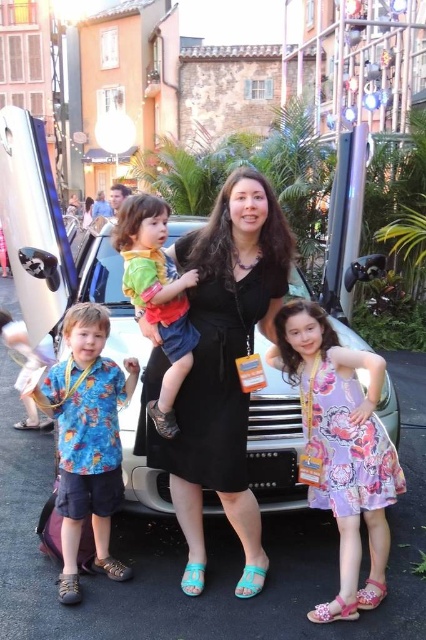
Question: Which of these objects is positioned farthest from the matte green shirt at center?

Choices:
 (A) matte black baby at upper left
 (B) floral dress at center
 (C) black matte dress at center
 (D) blue printed shirt at center

Answer: (A)

Question: Does floral dress at center come behind matte green shirt at center?

Choices:
 (A) no
 (B) yes

Answer: (A)

Question: Among these points, which one is nearest to the camera?

Choices:
 (A) (43, 403)
 (B) (310, 620)
 (C) (114, 205)

Answer: (B)

Question: Is black matte dress at center above floral dress at center?

Choices:
 (A) yes
 (B) no

Answer: (A)

Question: Among these points, which one is nearest to the camera?

Choices:
 (A) (123, 193)
 (B) (282, 328)
 (C) (201, 392)

Answer: (C)

Question: Is black matte dress at center positioned at the back of blue printed shirt at center?

Choices:
 (A) no
 (B) yes

Answer: (B)